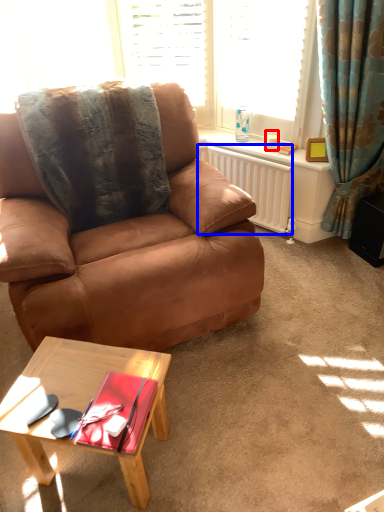
Question: Which point is further to the camera, coffee cup (highlighted by a red box) or radiator (highlighted by a blue box)?

Choices:
 (A) coffee cup
 (B) radiator

Answer: (A)